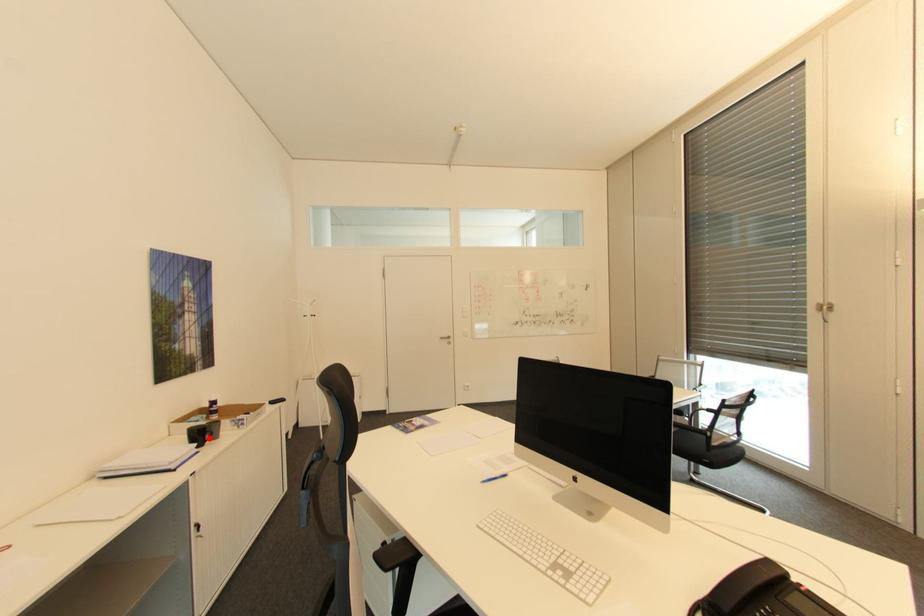
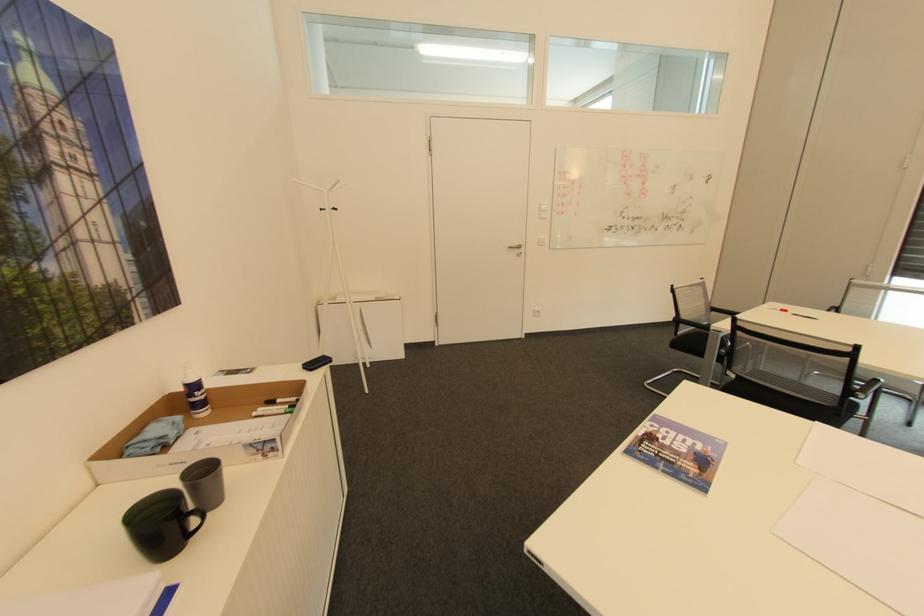
Where in the second image is the point corresponding to the highlighted location from the first image?

(188, 531)